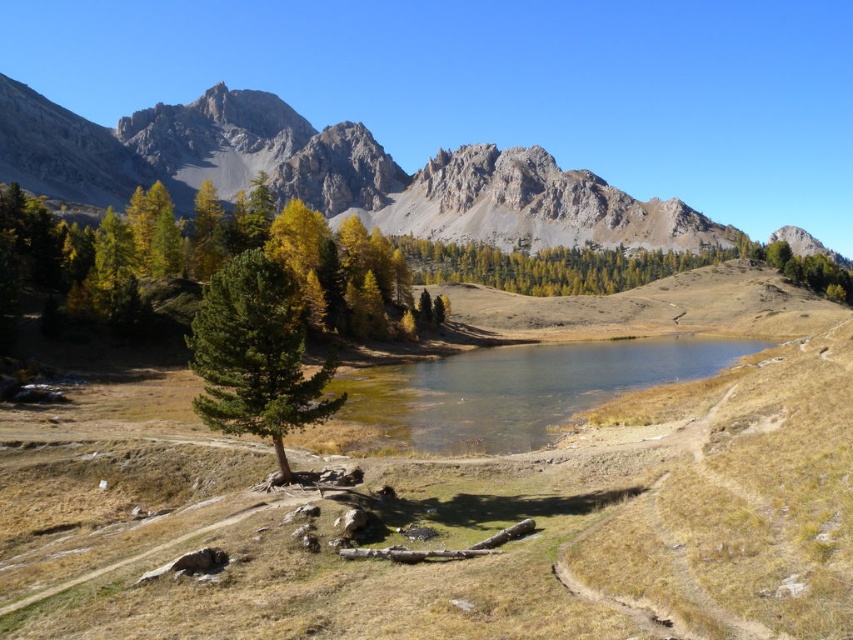
Question: Can you confirm if yellow-green foliage at left is positioned below clear water at center?

Choices:
 (A) yes
 (B) no

Answer: (B)

Question: Which of these objects is positioned farthest from the clear water at center?

Choices:
 (A) green matte tree at center
 (B) brown grassy hillside at center

Answer: (A)

Question: Which object appears closest to the camera in this image?

Choices:
 (A) brown grassy hillside at center
 (B) rugged stone mountain at upper left
 (C) green matte tree at center
 (D) clear water at center

Answer: (A)

Question: Can you confirm if brown grassy hillside at center is positioned to the right of rugged stone mountain at upper left?

Choices:
 (A) yes
 (B) no

Answer: (A)

Question: Does rugged stone mountain at upper left appear under yellow-green foliage at left?

Choices:
 (A) no
 (B) yes

Answer: (A)

Question: Which point is farther from the camera taking this photo?

Choices:
 (A) (289, 113)
 (B) (16, 506)
 (C) (250, 289)

Answer: (A)